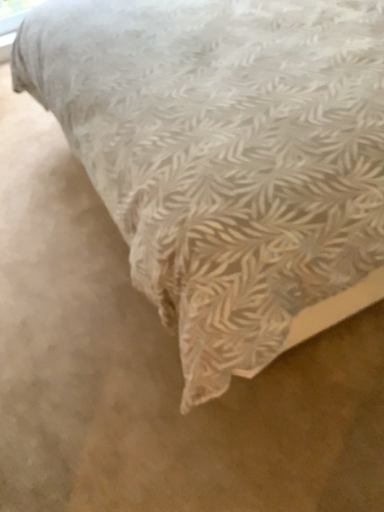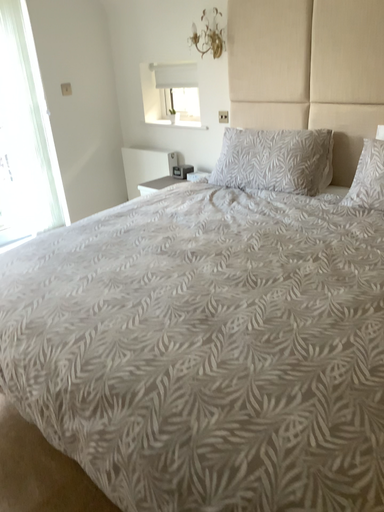
Question: How did the camera likely rotate when shooting the video?

Choices:
 (A) rotated right
 (B) rotated left

Answer: (A)